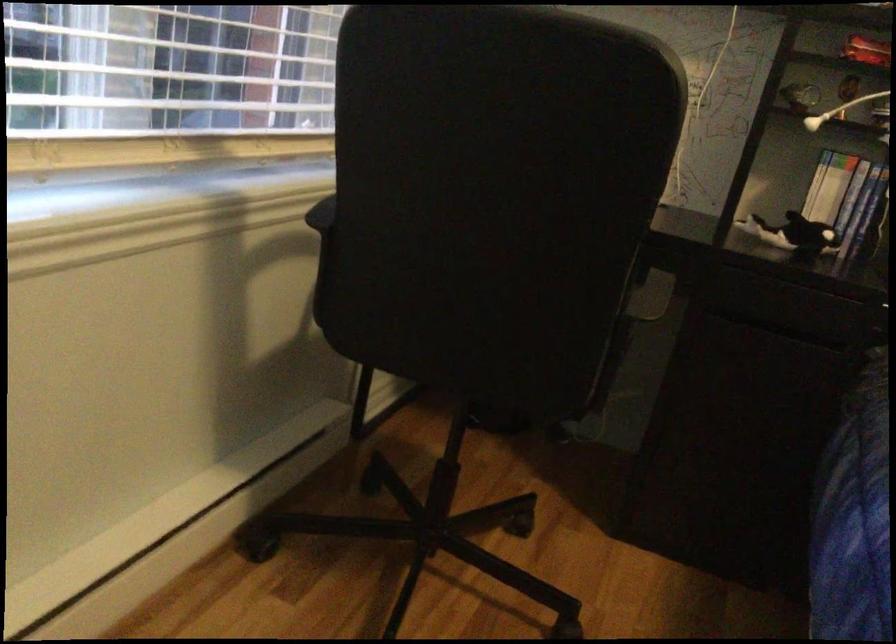
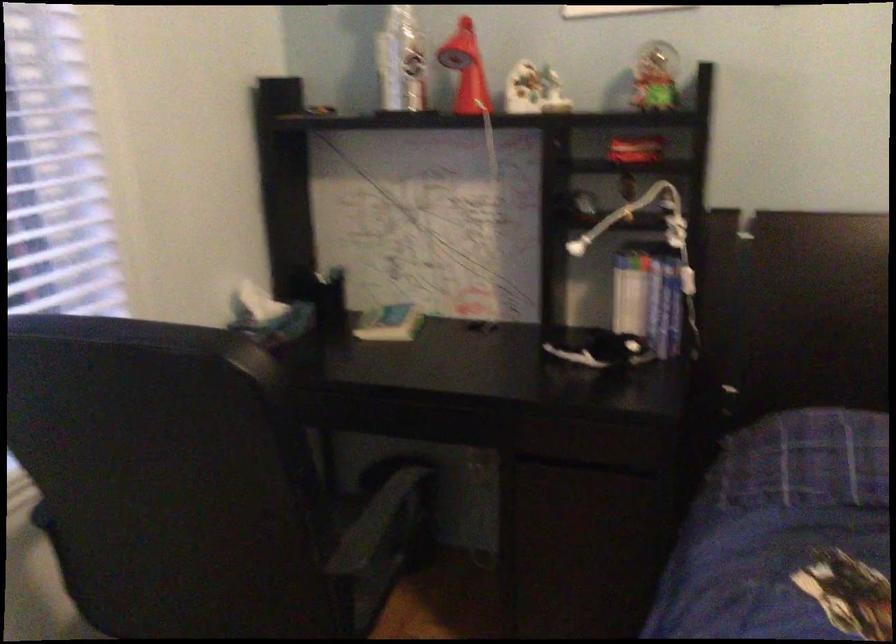
Question: I am providing you with two images of the same scene from different viewpoints. After the viewpoint changes to image2, which objects are now occluded?

Choices:
 (A) white lamp head
 (B) vertical blue book
 (C) silver bottle
 (D) none of these

Answer: (D)